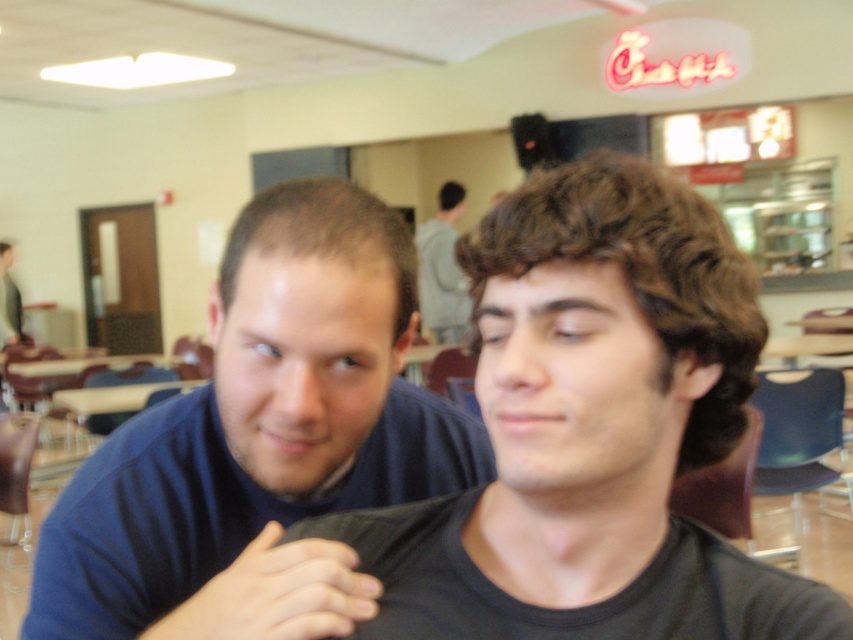
This screenshot has height=640, width=853. What do you see at coordinates (276, 595) in the screenshot?
I see `black matte phone at center` at bounding box center [276, 595].

Who is positioned more to the right, black matte phone at center or gray hoodie at upper center?

Positioned to the right is gray hoodie at upper center.

Which is behind, point (230, 595) or point (447, 291)?

Point (447, 291)

The image size is (853, 640). Identify the location of black matte phone at center. (276, 595).

Between matte blue shirt at center and gray hoodie at upper center, which one is positioned higher?

gray hoodie at upper center is higher up.

Between matte blue shirt at center and gray hoodie at upper center, which one has more height?

gray hoodie at upper center

What are the coordinates of `matte blue shirt at center` in the screenshot? It's located at (590, 432).

From the picture: Is matte blue shirt at center taller than blue matte shirt at center?

No, matte blue shirt at center is not taller than blue matte shirt at center.

This screenshot has height=640, width=853. What do you see at coordinates (590, 432) in the screenshot?
I see `matte blue shirt at center` at bounding box center [590, 432].

Where is `matte blue shirt at center`? matte blue shirt at center is located at coordinates (590, 432).